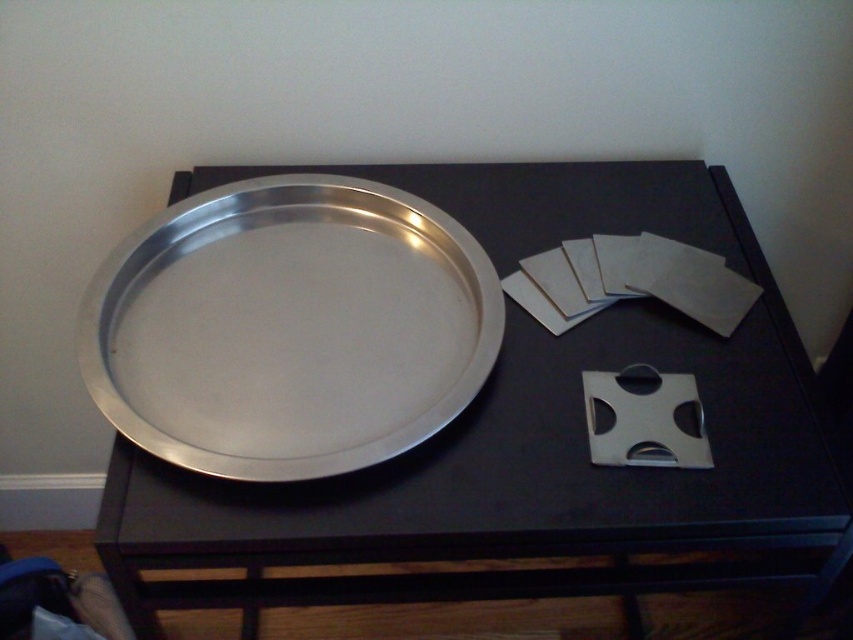
Between metallic silver tray at center and silver metallic tray at center, which one is positioned higher?

silver metallic tray at center

Is metallic silver tray at center thinner than silver metallic tray at center?

No, metallic silver tray at center is not thinner than silver metallic tray at center.

The width and height of the screenshot is (853, 640). I want to click on metallic silver tray at center, so click(527, 436).

The image size is (853, 640). In order to click on metallic silver tray at center in this screenshot , I will do (x=527, y=436).